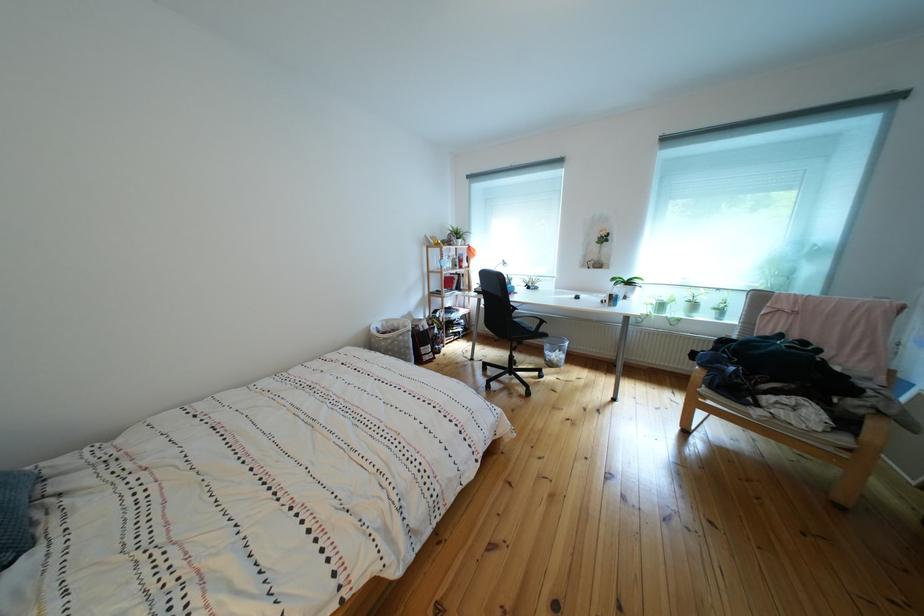
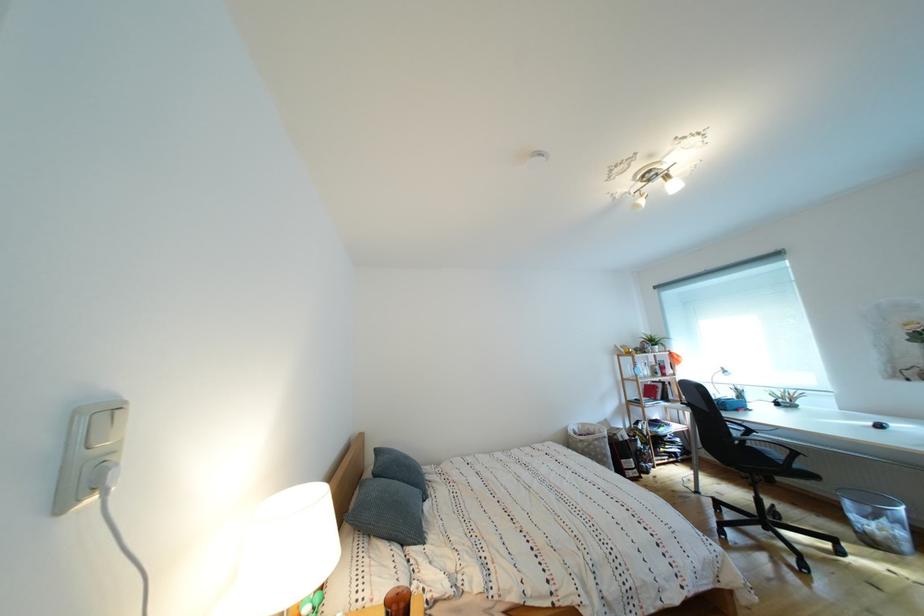
In the second image, find the point that corresponds to the point at 552,336 in the first image.

(808, 472)